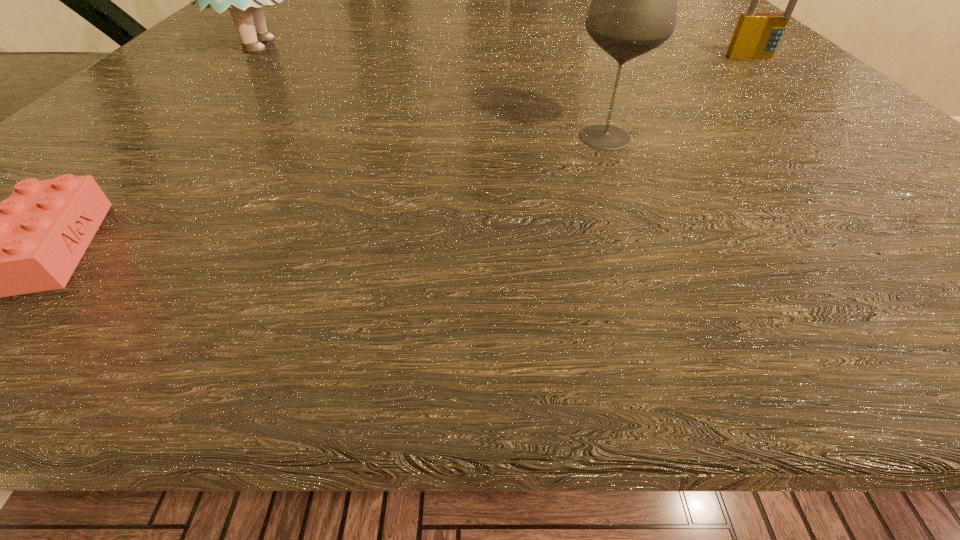
In order to click on vacant region at the left edge in this screenshot , I will do `click(174, 174)`.

The image size is (960, 540). In the image, there is a desktop. Find the location of `vacant area at the right edge`. vacant area at the right edge is located at coordinates (887, 181).

Image resolution: width=960 pixels, height=540 pixels. I want to click on vacant area that lies between the third tallest object and the doll, so click(x=504, y=52).

At what (x,y) coordinates should I click in order to perform the action: click on vacant area that lies between the second object from right to left and the third tallest object. Please return your answer as a coordinate pair (x, y). The image size is (960, 540). Looking at the image, I should click on (679, 98).

Locate an element on the screen. The width and height of the screenshot is (960, 540). object that stands as the third closest to the wineglass is located at coordinates (32, 241).

Locate which object ranks third in proximity to the wineglass. Please provide its 2D coordinates. Your answer should be formatted as a tuple, i.e. [(x, y)], where the tuple contains the x and y coordinates of a point satisfying the conditions above.

[(32, 241)]

The height and width of the screenshot is (540, 960). What are the coordinates of `vacant region that satisfies the following two spatial constraints: 1. on the front-facing side of the tallest object; 2. on the right side of the wineglass` in the screenshot? It's located at (165, 138).

Where is `vacant space that satisfies the following two spatial constraints: 1. on the front-facing side of the doll; 2. on the right side of the second nearest object`? This screenshot has height=540, width=960. vacant space that satisfies the following two spatial constraints: 1. on the front-facing side of the doll; 2. on the right side of the second nearest object is located at coordinates (165, 138).